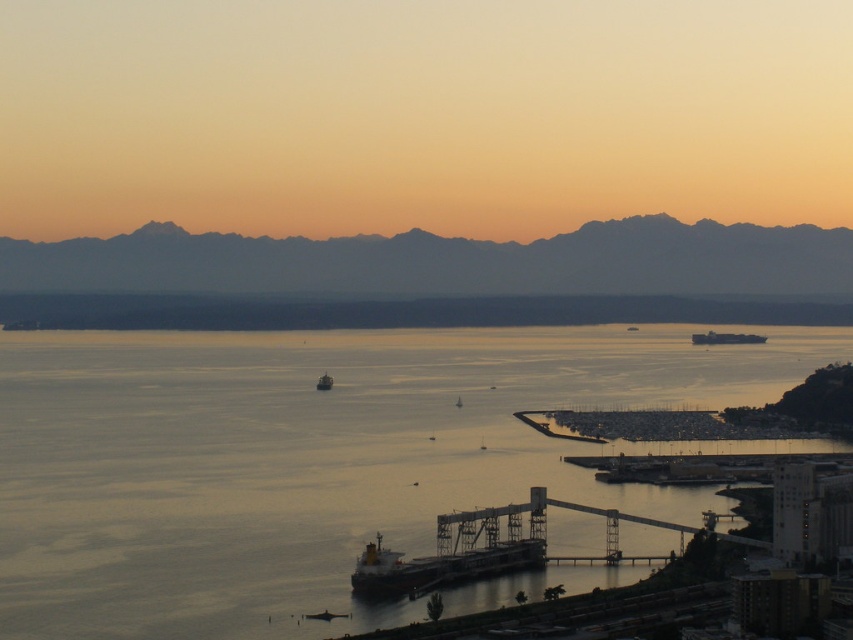
Is dark gray horizon at center smaller than smooth gray boat at right?

Incorrect, dark gray horizon at center is not smaller in size than smooth gray boat at right.

Who is more forward, (199, 317) or (697, 339)?

Point (199, 317) is in front.

Find the location of a particular element. dark gray horizon at center is located at coordinates (398, 310).

Based on the photo, between gray/distant mountain range at upper center and metallic gray ship at center, which one appears on the right side from the viewer's perspective?

From the viewer's perspective, gray/distant mountain range at upper center appears more on the right side.

Is point (350, 253) more distant than point (323, 381)?

That is True.

You are a GUI agent. You are given a task and a screenshot of the screen. Output one action in this format:
    pyautogui.click(x=<x>, y=<y>)
    Task: Click on the gray/distant mountain range at upper center
    The height and width of the screenshot is (640, 853).
    Given the screenshot: What is the action you would take?
    pyautogui.click(x=445, y=262)

Is smooth water at center shorter than dark gray horizon at center?

No.

Is smooth water at center positioned at the back of dark gray horizon at center?

That is False.

Between point (805, 372) and point (828, 320), which one is positioned behind?

Point (828, 320)

The height and width of the screenshot is (640, 853). What are the coordinates of `smooth water at center` in the screenshot? It's located at (316, 460).